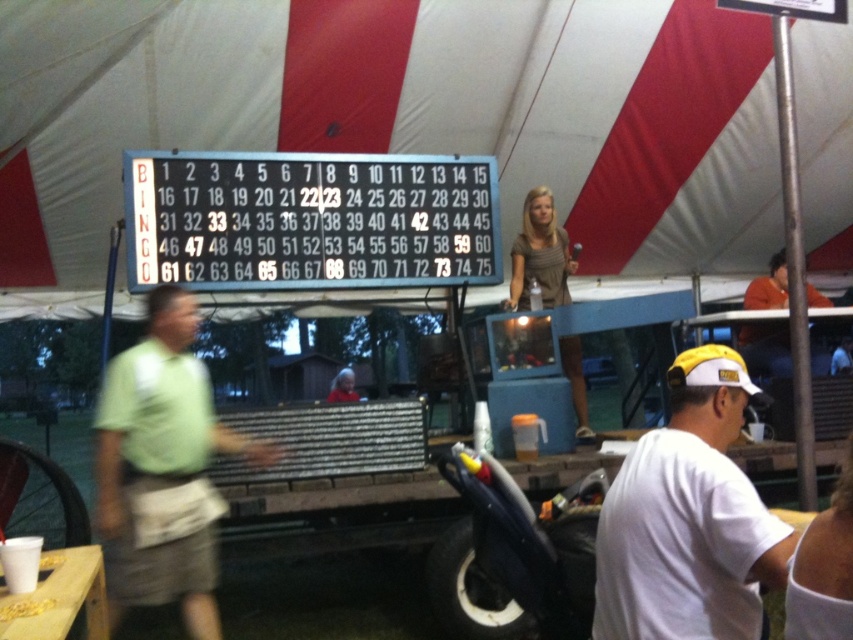
You are a photographer at the fair and want to capture both the white cotton shirt at lower right and the matte gray dress at center in a single shot. Based on their positions, which one should be placed on the right side of the frame to include both?

The white cotton shirt at lower right should be placed on the right side of the frame since it is already positioned on the right side of the matte gray dress at center.

You are a photographer at the fair and want to capture both the white cotton shirt at lower right and the matte gray dress at center in a single shot. Since you can only focus on one subject, which one should you choose to ensure the other remains in the background?

You should focus on the white cotton shirt at lower right because it is in front of the matte gray dress at center, so the dress will naturally be in the background when the shirt is in focus.

Based on the photo, you are standing at the fair and want to take a photo of the bingo board. You notice two points marked on the board at coordinates point (653,516) and point (167,456). Which point will appear larger in your photo?

Point (653,516) is closer to the camera than point (167,456), so it will appear larger in the photo.